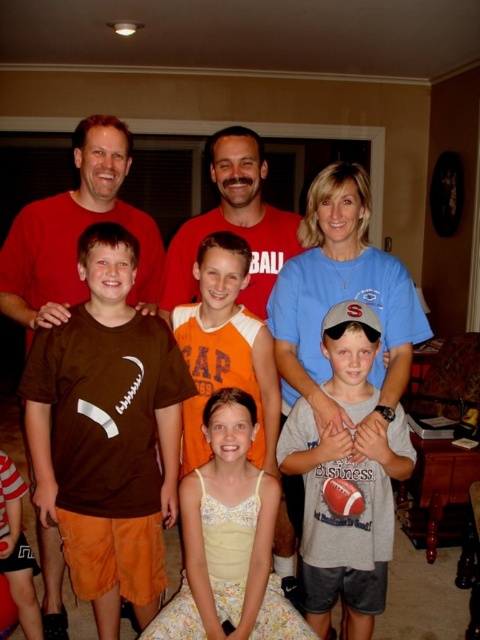
Question: Which object is the farthest from the gray cotton shirt at center?

Choices:
 (A) brown matte jersey at center
 (B) brown cotton t-shirt at center
 (C) matte red shirt at center
 (D) yellow lace dress at center

Answer: (C)

Question: From the image, what is the correct spatial relationship of brown cotton t-shirt at center in relation to yellow lace dress at center?

Choices:
 (A) below
 (B) above

Answer: (B)

Question: Which point is farther from the camera taking this photo?

Choices:
 (A) tap(129, 454)
 (B) tap(335, 518)
 (C) tap(184, 230)

Answer: (C)

Question: Among these points, which one is farthest from the camera?

Choices:
 (A) (240, 221)
 (B) (175, 627)
 (C) (127, 566)

Answer: (A)

Question: Is brown matte jersey at center positioned at the back of yellow lace dress at center?

Choices:
 (A) yes
 (B) no

Answer: (A)

Question: Where is gray cotton shirt at center located in relation to matte red shirt at center in the image?

Choices:
 (A) below
 (B) above

Answer: (A)